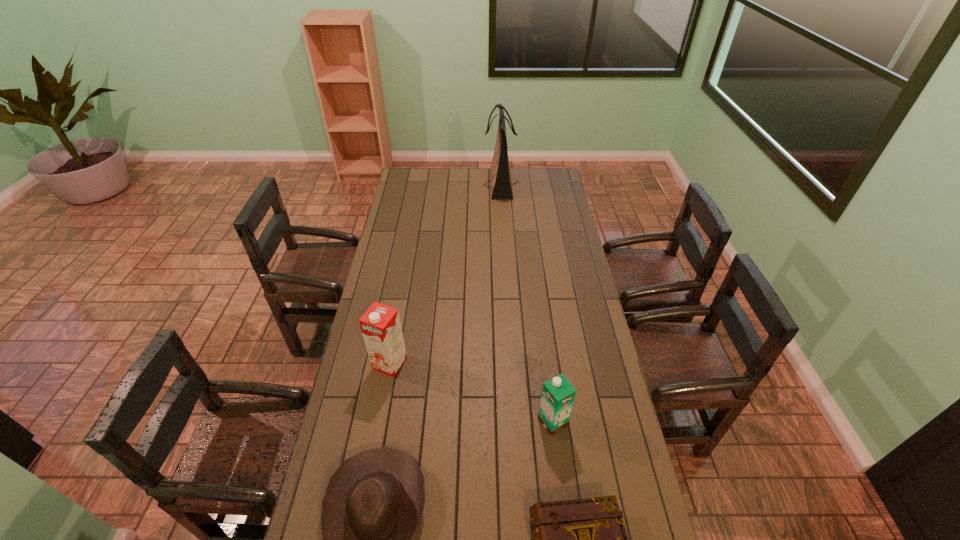
This screenshot has width=960, height=540. I want to click on shopping bag, so click(x=500, y=174).

The height and width of the screenshot is (540, 960). In order to click on the tallest object in this screenshot , I will do `click(500, 174)`.

The height and width of the screenshot is (540, 960). I want to click on the farther carton, so coord(381,327).

The image size is (960, 540). In order to click on the taller carton in this screenshot , I will do `click(381, 327)`.

The height and width of the screenshot is (540, 960). In order to click on the third nearest object in this screenshot , I will do `click(558, 394)`.

Identify the location of the shorter carton. (558, 394).

Identify the location of free region located on the front-facing side of the tallest object. The width and height of the screenshot is (960, 540). (425, 184).

The height and width of the screenshot is (540, 960). I want to click on free space located on the front-facing side of the tallest object, so click(465, 184).

I want to click on vacant area situated 0.200m on the front-facing side of the tallest object, so click(448, 184).

Locate an element on the screen. free point located on the front of the left carton is located at coordinates (370, 472).